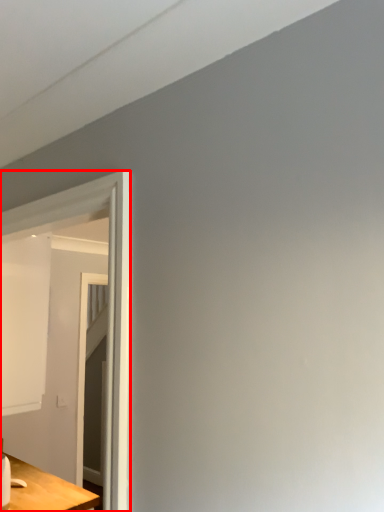
Question: In this image, where is glass door (annotated by the red box) located relative to table?

Choices:
 (A) right
 (B) left

Answer: (A)